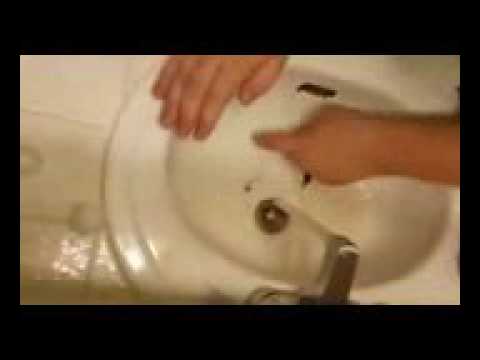
This screenshot has width=480, height=360. In order to click on sink basin in this screenshot , I will do `click(217, 212)`.